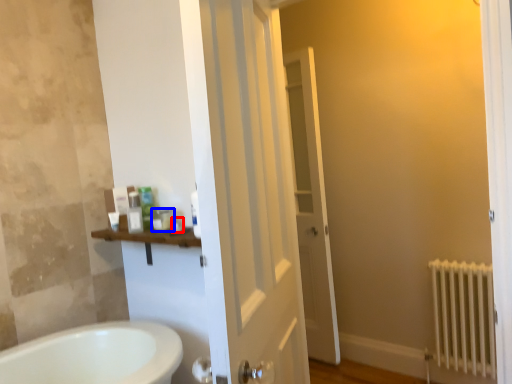
Question: Among these objects, which one is nearest to the camera, toiletry (highlighted by a red box) or toiletry (highlighted by a blue box)?

Choices:
 (A) toiletry
 (B) toiletry

Answer: (A)